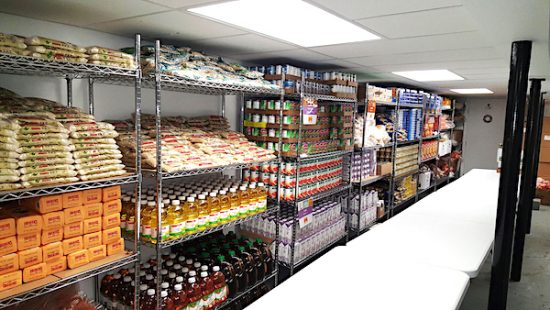
Where is `white tables`? white tables is located at coordinates (422, 295), (455, 236).